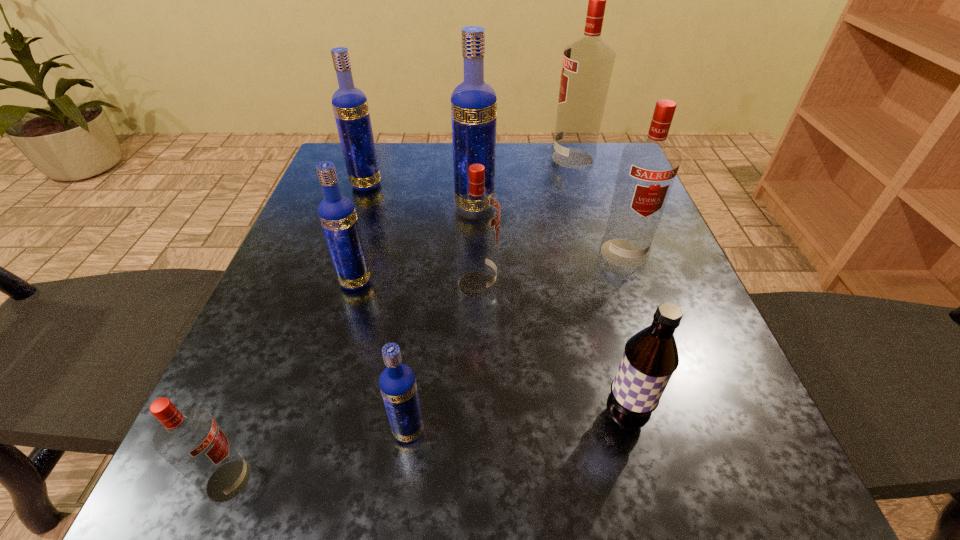
Find the location of `the biggest red vodka`. the biggest red vodka is located at coordinates (587, 65).

Find the location of a particular element. The width and height of the screenshot is (960, 540). the farthest vodka is located at coordinates (587, 65).

Locate an element on the screen. This screenshot has width=960, height=540. the second farthest blue vodka is located at coordinates (473, 102).

This screenshot has width=960, height=540. I want to click on the third farthest object, so click(x=473, y=102).

Find the location of a particular element. The width and height of the screenshot is (960, 540). the seventh nearest vodka is located at coordinates (350, 106).

Identify the location of the farthest blue vodka. The width and height of the screenshot is (960, 540). (350, 106).

Locate an element on the screen. the fourth farthest vodka is located at coordinates (648, 167).

This screenshot has width=960, height=540. I want to click on the sixth nearest object, so click(x=648, y=167).

This screenshot has height=540, width=960. In order to click on the second smallest blue vodka in this screenshot , I will do `click(337, 214)`.

You are a GUI agent. You are given a task and a screenshot of the screen. Output one action in this format:
    pyautogui.click(x=<x>, y=<y>)
    Task: Click on the third red vodka from right to left
    
    Given the screenshot: What is the action you would take?
    pyautogui.click(x=476, y=214)